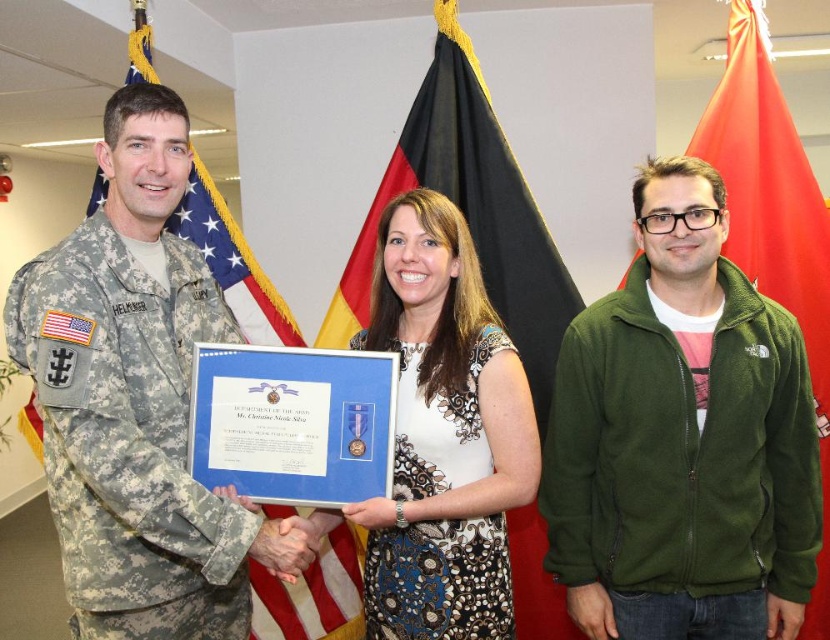
Question: Which point is closer to the camera?

Choices:
 (A) green fleece jacket at center
 (B) american flag at left
 (C) black fabric flag at center

Answer: (A)

Question: Among these objects, which one is farthest from the camera?

Choices:
 (A) green fleece jacket at center
 (B) matte blue fabric at center

Answer: (A)

Question: Can you confirm if camouflage fabric uniform at left is smaller than matte blue fabric at center?

Choices:
 (A) no
 (B) yes

Answer: (A)

Question: Does green fleece jacket at center have a greater width compared to american flag at left?

Choices:
 (A) no
 (B) yes

Answer: (B)

Question: Can you confirm if camouflage fabric uniform at left is smaller than matte blue fabric at center?

Choices:
 (A) yes
 (B) no

Answer: (B)

Question: Which object appears closest to the camera in this image?

Choices:
 (A) black fabric flag at center
 (B) matte blue fabric at center
 (C) american flag at left

Answer: (B)